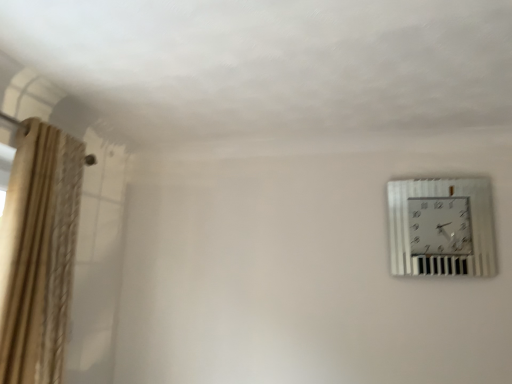
Question: Looking at their shapes, would you say metallic silver wall clock at upper right is wider or thinner than beige textured curtain at left?

Choices:
 (A) thin
 (B) wide

Answer: (A)

Question: From a real-world perspective, is metallic silver wall clock at upper right above or below beige textured curtain at left?

Choices:
 (A) below
 (B) above

Answer: (B)

Question: Choose the correct answer: Is metallic silver wall clock at upper right inside beige textured curtain at left or outside it?

Choices:
 (A) outside
 (B) inside

Answer: (A)

Question: Does point (58, 208) appear closer or farther from the camera than point (391, 216)?

Choices:
 (A) farther
 (B) closer

Answer: (B)

Question: Looking at the image, does beige textured curtain at left seem bigger or smaller compared to metallic silver wall clock at upper right?

Choices:
 (A) small
 (B) big

Answer: (B)

Question: From a real-world perspective, is beige textured curtain at left positioned above or below metallic silver wall clock at upper right?

Choices:
 (A) below
 (B) above

Answer: (A)

Question: In terms of width, does beige textured curtain at left look wider or thinner when compared to metallic silver wall clock at upper right?

Choices:
 (A) wide
 (B) thin

Answer: (A)